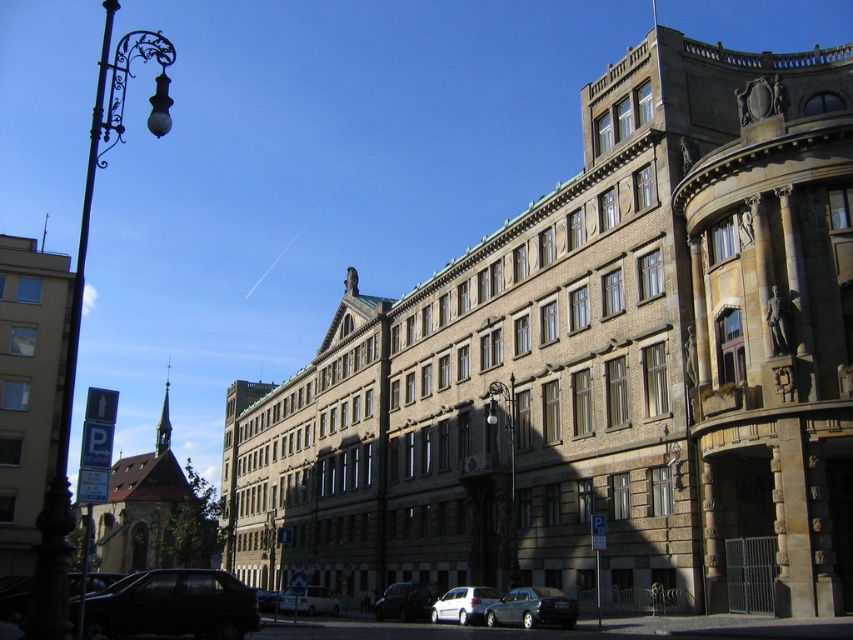
You are driving a delivery truck that is 3 meters long and needs to park between the silver metallic van at lower center and the white matte van at center. Can you fit your truck between them without overlapping either vehicle?

The distance between the silver metallic van at lower center and the white matte van at center is 11.02 meters. Since your truck is only 3 meters long, there is sufficient space to park between them without overlapping either vehicle.

You are a delivery driver who needs to park your vehicle in a tight space near the building. You have two vans available, the silver metallic van at lower center and the white matte van at center. Which van should you choose to ensure it fits better in the space?

The silver metallic van at lower center has a smaller size compared to the white matte van at center, so you should choose the silver metallic van at lower center to ensure it fits better in the tight space.